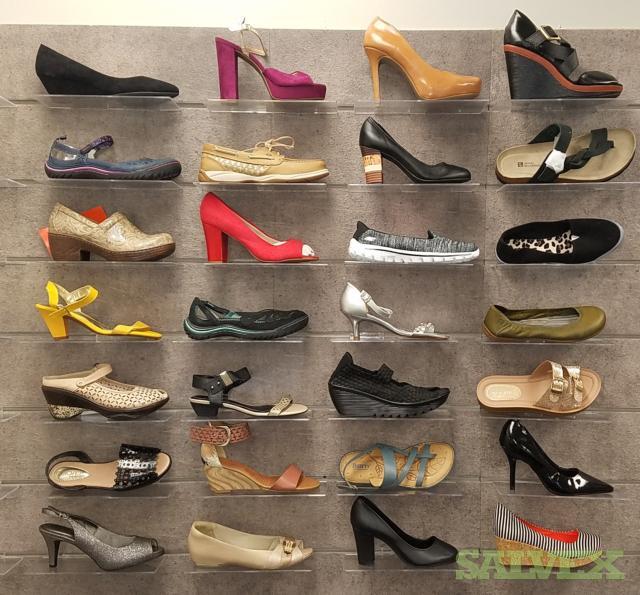
Where is `4th column of shoes`? 4th column of shoes is located at coordinates (537, 76), (544, 154), (538, 241), (537, 325), (538, 385), (538, 460), (534, 537).